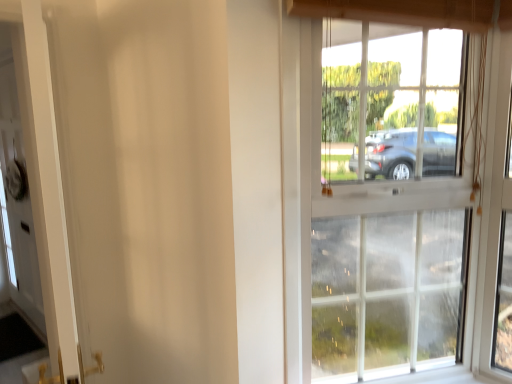
Where is `clear glass window at right`? The height and width of the screenshot is (384, 512). clear glass window at right is located at coordinates (393, 197).

In order to face clear glass window at right, should I rotate leftwards or rightwards?

Turn right approximately 17.687 degrees to face it.

What do you see at coordinates (393, 197) in the screenshot? I see `clear glass window at right` at bounding box center [393, 197].

What is the approximate height of clear glass window at right?

4.14 feet.

Image resolution: width=512 pixels, height=384 pixels. I want to click on clear glass window at right, so click(x=393, y=197).